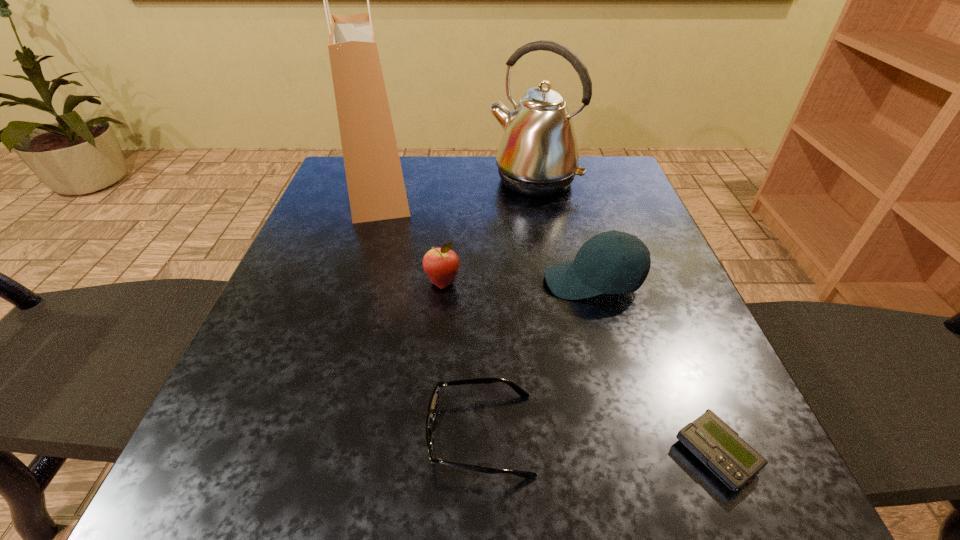
Find the location of a particular element. This screenshot has height=540, width=960. the leftmost object is located at coordinates (376, 188).

At what (x,y) coordinates should I click in order to perform the action: click on shopping bag. Please return your answer as a coordinate pair (x, y). This screenshot has width=960, height=540. Looking at the image, I should click on (376, 188).

Locate an element on the screen. The width and height of the screenshot is (960, 540). the second tallest object is located at coordinates (538, 156).

Locate an element on the screen. Image resolution: width=960 pixels, height=540 pixels. baseball cap is located at coordinates (612, 262).

What are the coordinates of `apple` in the screenshot? It's located at (441, 265).

Locate an element on the screen. spectacles is located at coordinates click(433, 404).

Find the location of `the shortest object`. the shortest object is located at coordinates (710, 439).

The width and height of the screenshot is (960, 540). In order to click on blank space located on the right of the leftmost object in this screenshot , I will do `click(441, 187)`.

Identify the location of vacant space located 0.120m on the front of the kettle. (543, 232).

Find the location of a particular element. vacant space located 0.120m on the front-facing side of the baseball cap is located at coordinates (481, 281).